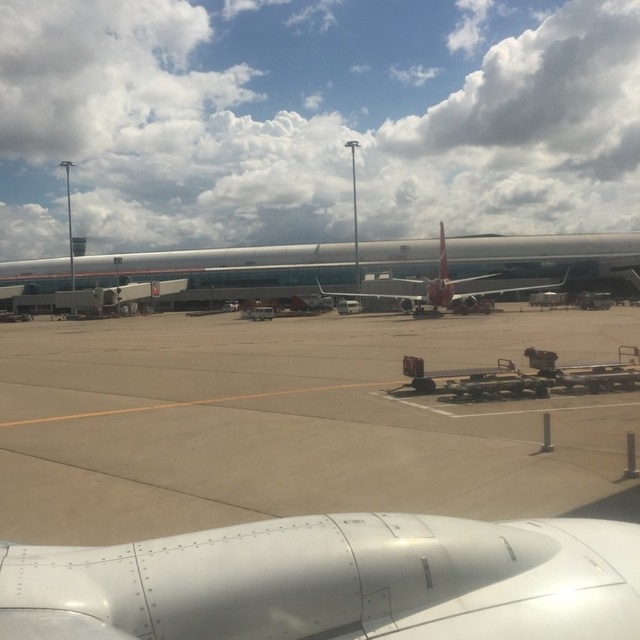
You are a photographer standing on the tarmac and want to take a photo that includes both the point at coordinates point (556, 168) and point (442, 272). Which point will appear closer to the edge of the camera frame?

Point (556, 168) is further to the camera than point (442, 272), so point (442, 272) will appear closer to the edge of the camera frame.

You are a pilot sitting in the cockpit of an airplane parked at the airport. You notice two points marked on the tarmac through the window. The first point is at coordinate point (246, 419) and the second point is at coordinate point (484, 296). From your current position in the cockpit, which point is closer to you?

Point (246, 419) is in front of point (484, 296), so it is closer to your current position in the cockpit.